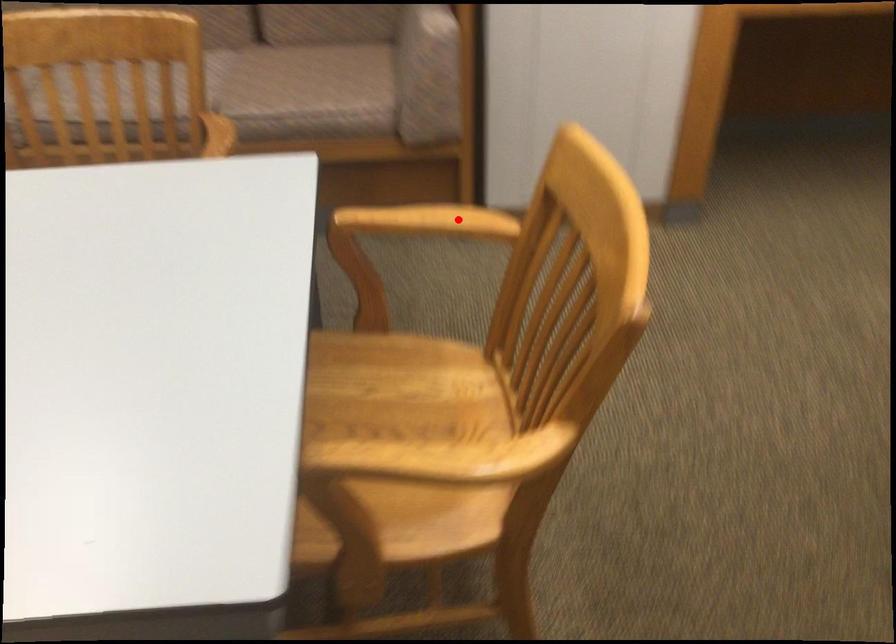
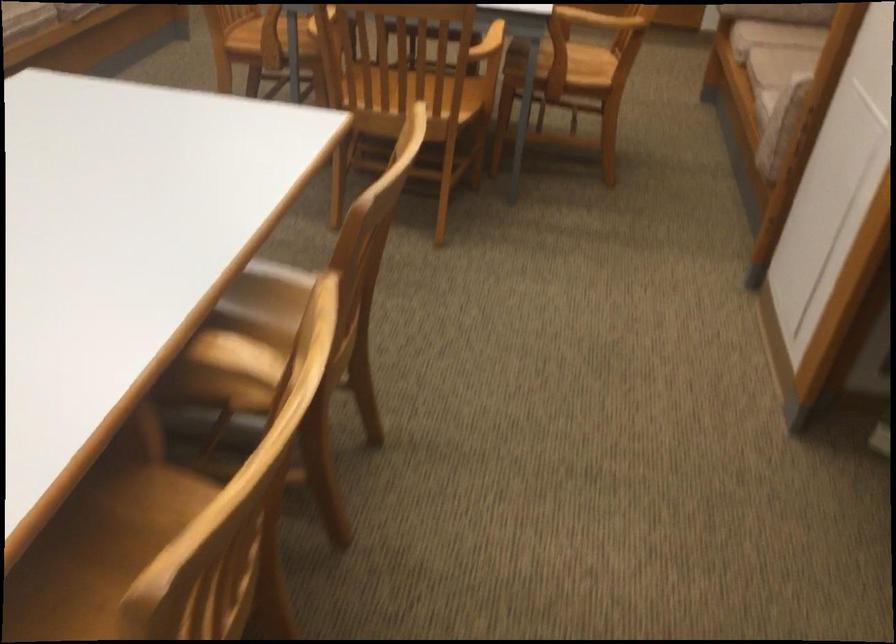
In the second image, find the point that corresponds to the highlighted location in the first image.

(488, 43)